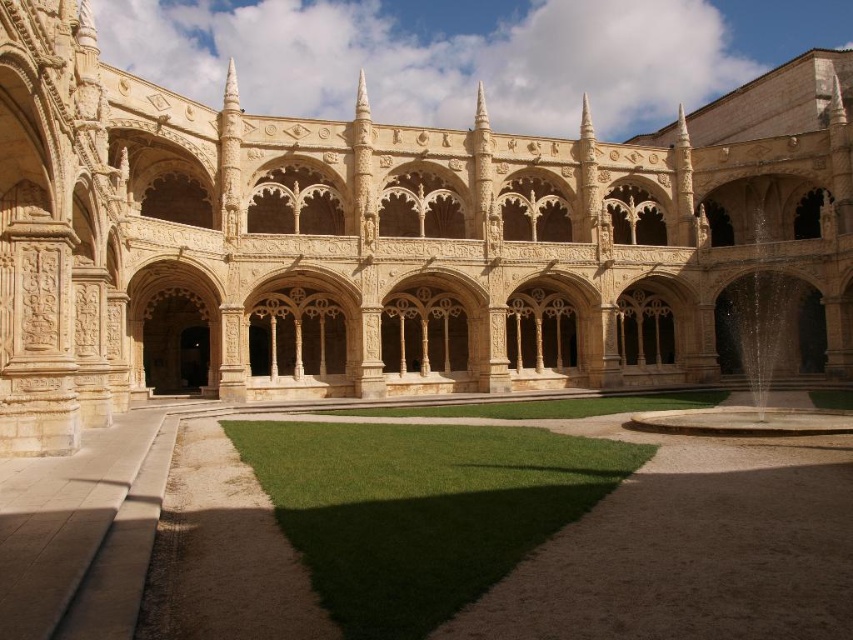
Question: Does beige stone arches at center have a larger size compared to green grass at center?

Choices:
 (A) yes
 (B) no

Answer: (A)

Question: Which of the following is the closest to the observer?

Choices:
 (A) beige stone arches at center
 (B) green grass at center

Answer: (B)

Question: Is beige stone arches at center bigger than green grass at center?

Choices:
 (A) no
 (B) yes

Answer: (B)

Question: Which object is farther from the camera taking this photo?

Choices:
 (A) beige stone arches at center
 (B) green grass at center

Answer: (A)

Question: In this image, where is beige stone arches at center located relative to green grass at center?

Choices:
 (A) left
 (B) right

Answer: (B)

Question: Among these objects, which one is farthest from the camera?

Choices:
 (A) green grass at center
 (B) beige stone arches at center

Answer: (B)